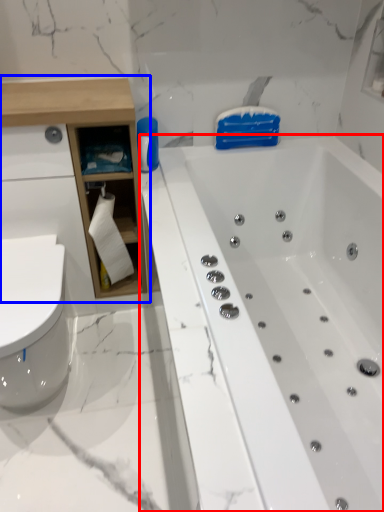
Question: Which object is further to the camera taking this photo, bathtub (highlighted by a red box) or cabinetry (highlighted by a blue box)?

Choices:
 (A) bathtub
 (B) cabinetry

Answer: (B)